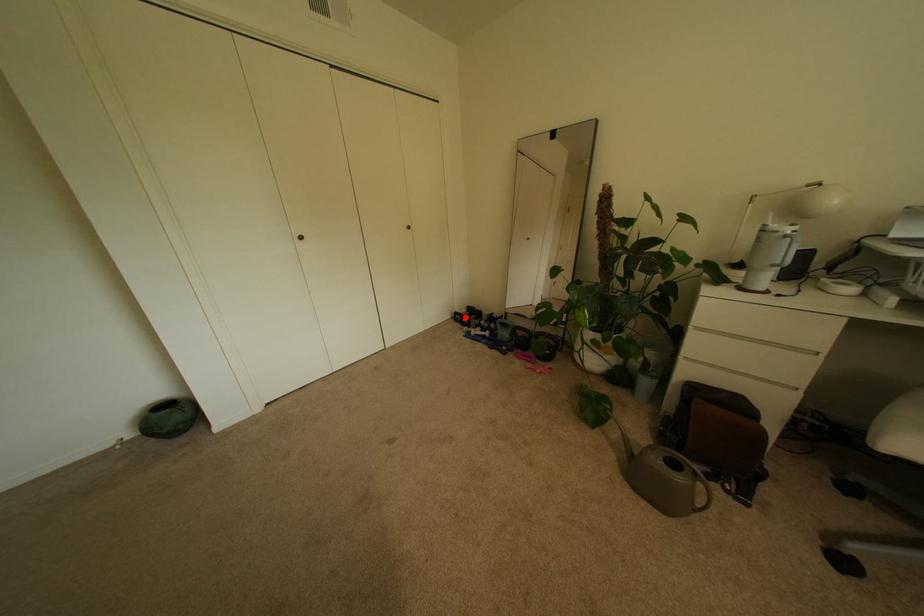
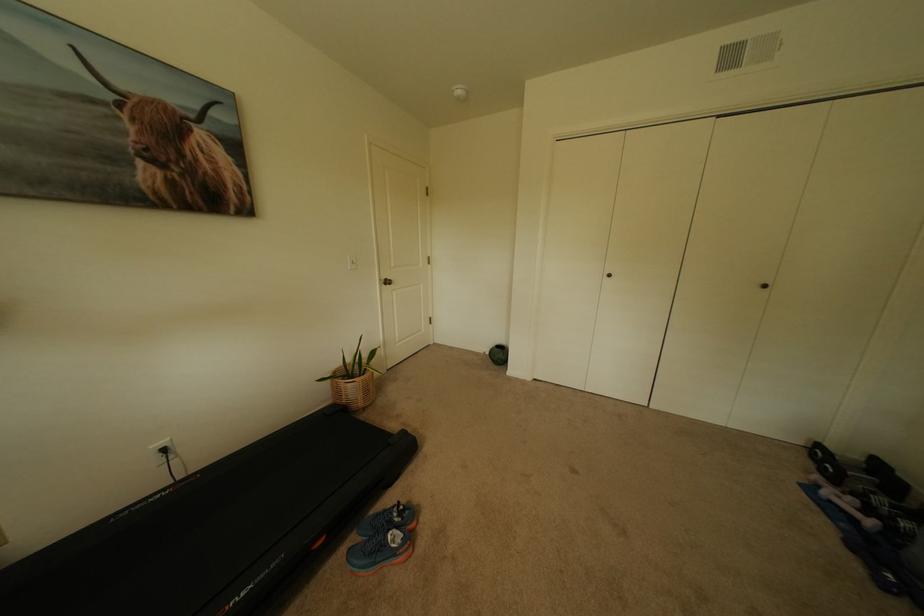
Question: I am providing you with two images of the same scene from different viewpoints. A red point is shown in image1. For the corresponding object point in image2, is it positioned nearer or farther from the camera?

Choices:
 (A) Nearer
 (B) Farther

Answer: (A)